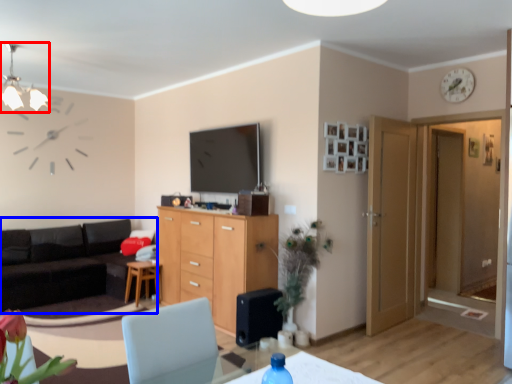
Question: Which point is closer to the camera, light fixture (highlighted by a red box) or studio couch (highlighted by a blue box)?

Choices:
 (A) light fixture
 (B) studio couch

Answer: (A)